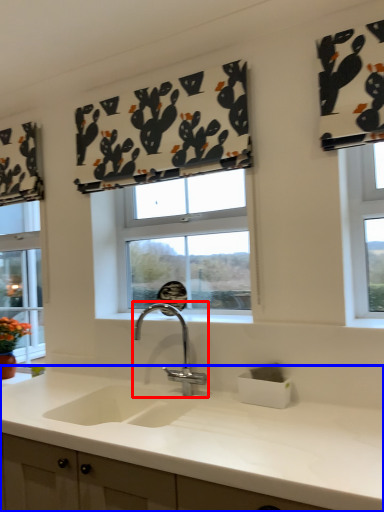
Question: Which object appears farthest to the camera in this image, tap (highlighted by a red box) or countertop (highlighted by a blue box)?

Choices:
 (A) tap
 (B) countertop

Answer: (A)